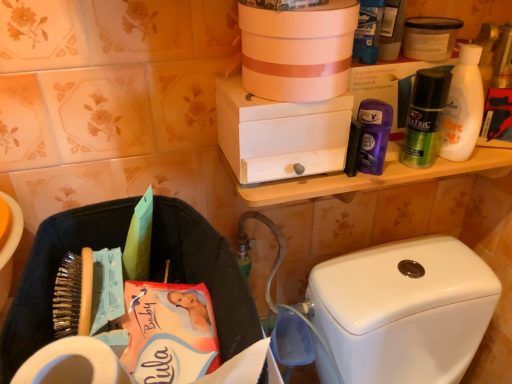
Locate an element on the screen. Image resolution: width=512 pixels, height=384 pixels. free space above white glossy toilet tank at lower right (from a real-world perspective) is located at coordinates (409, 274).